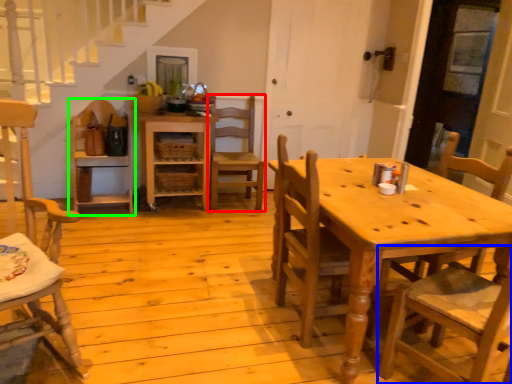
Question: Considering the real-world distances, which object is closest to chair (highlighted by a red box)? chair (highlighted by a blue box) or chair (highlighted by a green box).

Choices:
 (A) chair
 (B) chair

Answer: (B)